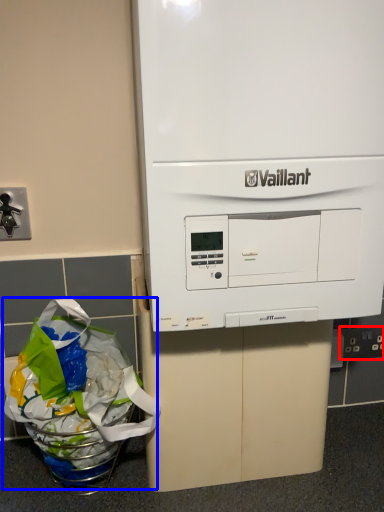
Question: Which object appears farthest to the camera in this image, electric outlet (highlighted by a red box) or grocery bag (highlighted by a blue box)?

Choices:
 (A) electric outlet
 (B) grocery bag

Answer: (A)